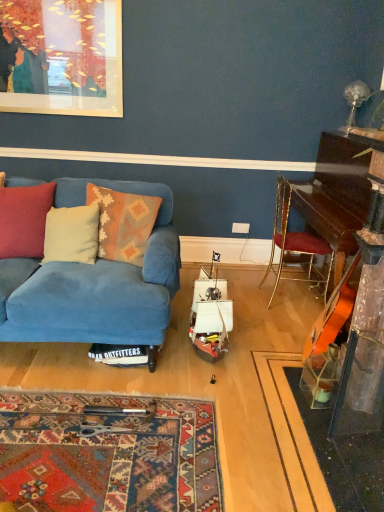
Question: Should I look upward or downward to see gold metallic chair at right?

Choices:
 (A) down
 (B) up

Answer: (B)

Question: Does blue fabric couch at left have a lesser width compared to white plastic power outlet at center?

Choices:
 (A) no
 (B) yes

Answer: (A)

Question: Does blue fabric couch at left have a larger size compared to white plastic power outlet at center?

Choices:
 (A) no
 (B) yes

Answer: (B)

Question: Is blue fabric couch at left oriented towards white plastic power outlet at center?

Choices:
 (A) yes
 (B) no

Answer: (B)

Question: From a real-world perspective, is blue fabric couch at left beneath white plastic power outlet at center?

Choices:
 (A) no
 (B) yes

Answer: (A)

Question: Is blue fabric couch at left wider than white plastic power outlet at center?

Choices:
 (A) no
 (B) yes

Answer: (B)

Question: Is blue fabric couch at left far from white plastic power outlet at center?

Choices:
 (A) yes
 (B) no

Answer: (A)

Question: Is blue fabric couch at left positioned with its back to beige fabric pillow at left, which ranks as the 2th pillow in left-to-right order?

Choices:
 (A) no
 (B) yes

Answer: (B)

Question: Does blue fabric couch at left have a larger size compared to beige fabric pillow at left, which is the second pillow in right-to-left order?

Choices:
 (A) yes
 (B) no

Answer: (A)

Question: Is blue fabric couch at left smaller than beige fabric pillow at left, which ranks as the 2th pillow in left-to-right order?

Choices:
 (A) yes
 (B) no

Answer: (B)

Question: From the image's perspective, is blue fabric couch at left on beige fabric pillow at left, which is the second pillow in right-to-left order?

Choices:
 (A) no
 (B) yes

Answer: (A)

Question: Considering the relative sizes of blue fabric couch at left and beige fabric pillow at left, which is the second pillow in right-to-left order, in the image provided, is blue fabric couch at left taller than beige fabric pillow at left, which is the second pillow in right-to-left order,?

Choices:
 (A) yes
 (B) no

Answer: (A)

Question: Is blue fabric couch at left not within beige fabric pillow at left, which is the second pillow in right-to-left order?

Choices:
 (A) no
 (B) yes

Answer: (B)

Question: Does white plastic power outlet at center lie behind beige fabric pillow at left, which ranks as the 2th pillow in left-to-right order?

Choices:
 (A) no
 (B) yes

Answer: (B)